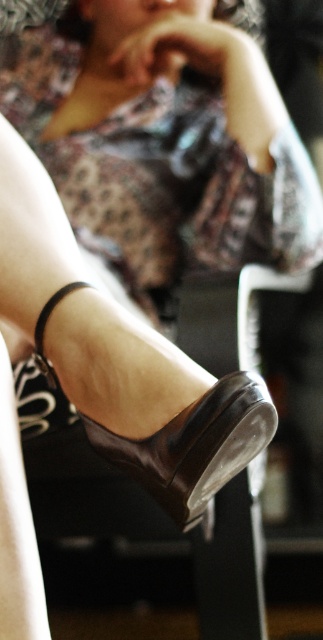
You are a fashion designer observing the image. You need to decide which item takes up more space visually in the scene. Which object is larger in size between the matte floral dress at center and the shiny brown sandal at lower center?

The matte floral dress at center is bigger than the shiny brown sandal at lower center, so the matte floral dress at center takes up more visual space in the scene.

You are a fashion designer observing the image. You need to determine which item, the matte floral dress at center or the shiny brown sandal at lower center, reaches higher on the body. Which one is it?

The matte floral dress at center reaches higher on the body since it has a greater height compared to the shiny brown sandal at lower center.

You are trying to decide whether the shiny brown sandal at lower center can fit inside the matte floral dress at center. Based on their sizes, is this possible?

The matte floral dress at center is wider than the shiny brown sandal at lower center, so it is possible for the sandal to fit inside the dress.